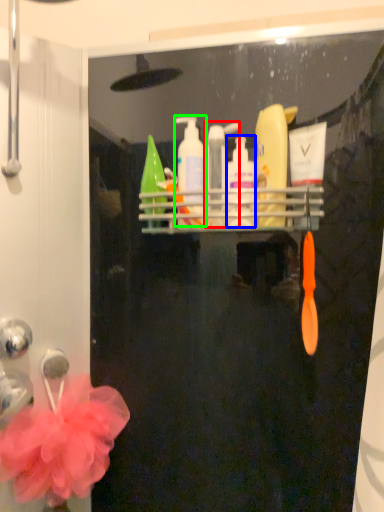
Question: Which object is positioned farthest from mouthwash (highlighted by a red box)? Select from cleaning product (highlighted by a blue box) and cleaning product (highlighted by a green box).

Choices:
 (A) cleaning product
 (B) cleaning product

Answer: (B)